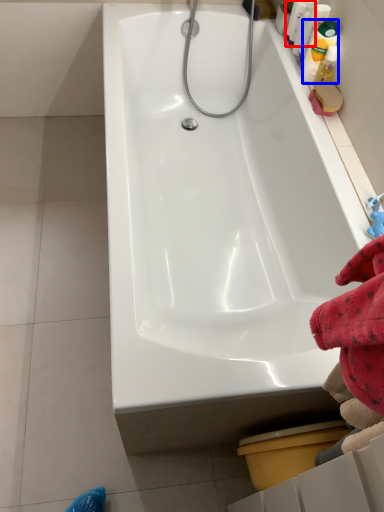
Question: Which point is further to the camera, cleaning product (highlighted by a red box) or cleaning product (highlighted by a blue box)?

Choices:
 (A) cleaning product
 (B) cleaning product

Answer: (A)